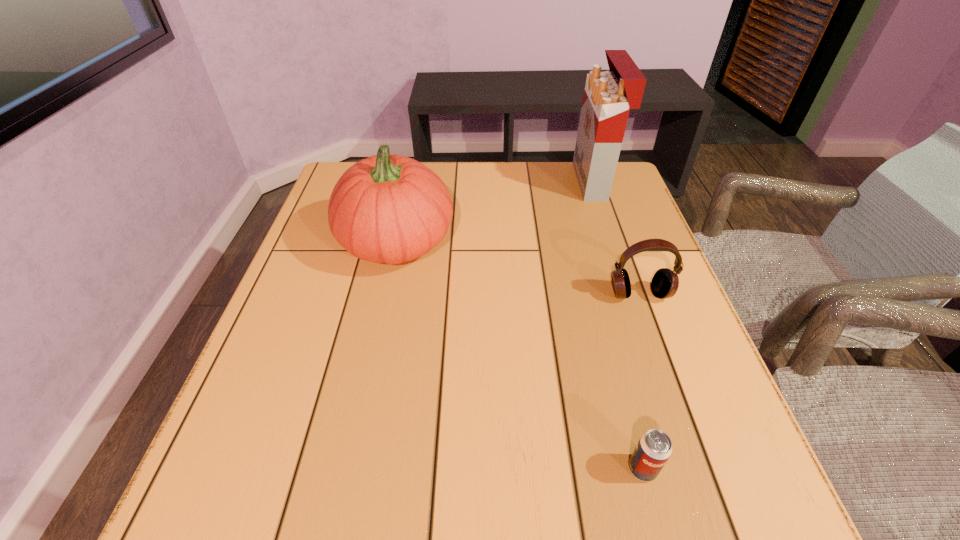
Find the location of a particular element. The height and width of the screenshot is (540, 960). beer can present at the right edge is located at coordinates (654, 448).

Locate an element on the screen. object situated at the far left corner is located at coordinates (390, 209).

Locate an element on the screen. The height and width of the screenshot is (540, 960). object at the far right corner is located at coordinates (608, 96).

Image resolution: width=960 pixels, height=540 pixels. In order to click on object positioned at the near right corner in this screenshot , I will do `click(654, 448)`.

Image resolution: width=960 pixels, height=540 pixels. I want to click on free space at the far edge of the desktop, so pos(508,194).

The image size is (960, 540). Identify the location of free space at the left edge. (281, 322).

In the image, there is a desktop. Where is `vacant space at the right edge`? vacant space at the right edge is located at coordinates (673, 338).

In the image, there is a desktop. What are the coordinates of `vacant space at the far right corner` in the screenshot? It's located at (616, 204).

This screenshot has height=540, width=960. I want to click on free space that is in between the third shortest object and the headset, so coord(517,267).

You are a GUI agent. You are given a task and a screenshot of the screen. Output one action in this format:
    pyautogui.click(x=<x>, y=<y>)
    Task: Click on the vacant space that is in between the cigarette case and the beer can
    
    Given the screenshot: What is the action you would take?
    pyautogui.click(x=618, y=325)